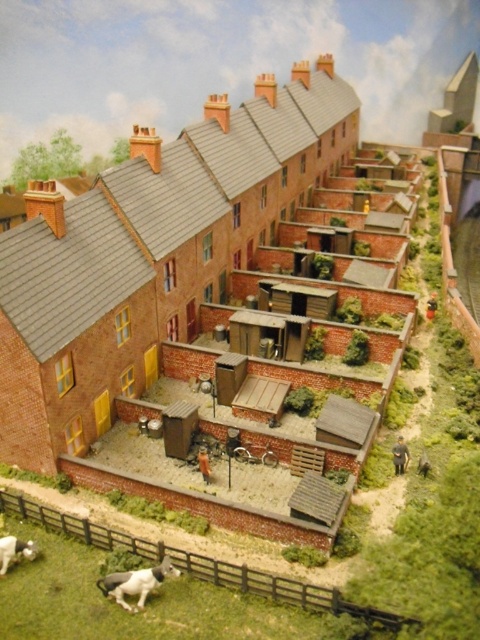
You are standing at the center of the image and want to reach the white glossy horse at lower left and the white fur dog at lower left. Which animal is closer to you?

The white glossy horse at lower left is 3.83 meters away from the white fur dog at lower left. Since you are at the center, the distance to each animal depends on their positions. However, the question asks which is closer, but the description only provides the distance between them, not their individual distances from the center. Therefore, we cannot determine which is closer based on the given information.

You are a visitor standing in front of the row of terraced houses. You see a white glossy horse at lower left and a white fur dog at lower left. Which animal is closer to you?

The white glossy horse at lower left is positioned under the white fur dog at lower left, meaning the dog is closer to you.

You are a photographer planning to capture a photo of the white glossy horse at lower left and the white fur dog at lower left. If you want to ensure both animals fit in the frame without cropping, which animal requires more space horizontally?

The white glossy horse at lower left requires more horizontal space because its width surpasses that of the white fur dog at lower left.